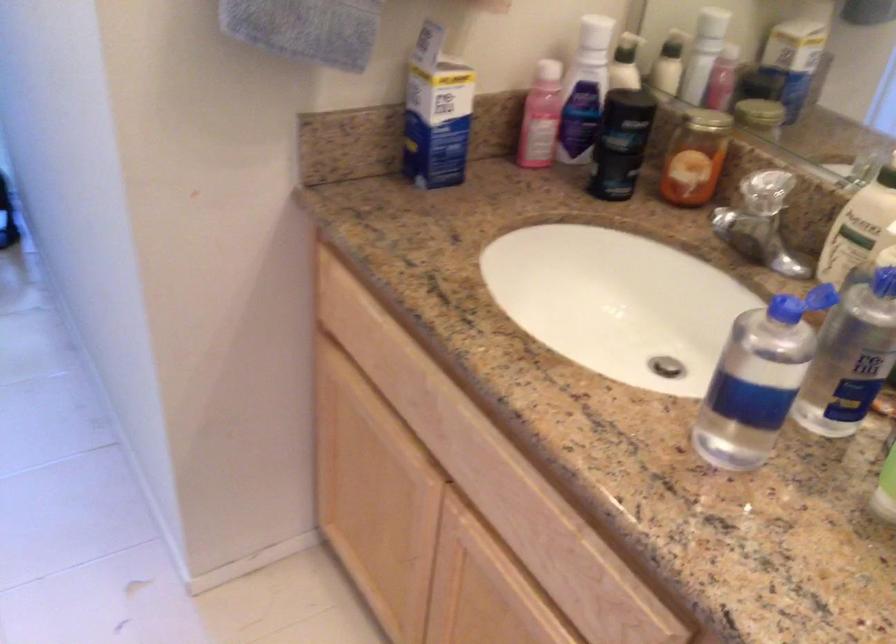
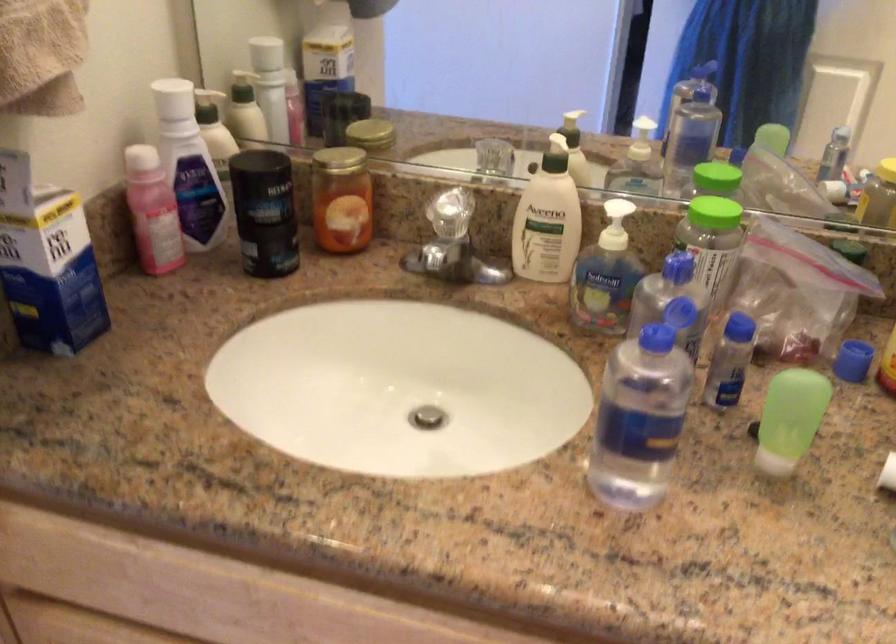
Find the pixel in the second image that matches point 608,138 in the first image.

(264, 212)